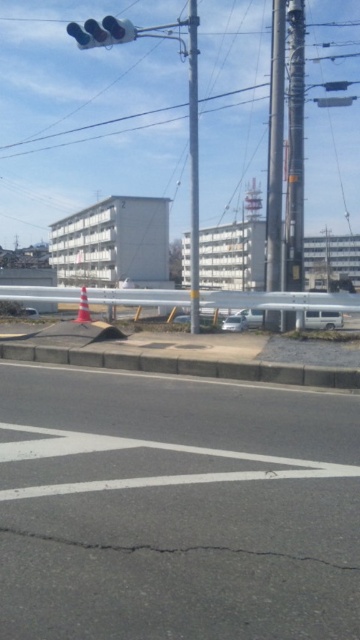
Is metallic traffic light at upper center to the left of orange reflective cone at center from the viewer's perspective?

Yes, metallic traffic light at upper center is to the left of orange reflective cone at center.

Is metallic traffic light at upper center further to camera compared to orange reflective cone at center?

Yes, metallic traffic light at upper center is behind orange reflective cone at center.

Between point (93, 32) and point (86, 314), which one is positioned behind?

The point (86, 314) is behind.

At what (x,y) coordinates should I click in order to perform the action: click on metallic traffic light at upper center. Please return your answer as a coordinate pair (x, y). Looking at the image, I should click on (101, 33).

Can you confirm if metallic gray pole at upper right is positioned below metallic pole at center?

Correct, metallic gray pole at upper right is located below metallic pole at center.

Is metallic gray pole at upper right bigger than metallic pole at center?

No, metallic gray pole at upper right is not bigger than metallic pole at center.

Which is in front, point (279, 179) or point (198, 248)?

Point (198, 248) is more forward.

You are a GUI agent. You are given a task and a screenshot of the screen. Output one action in this format:
    pyautogui.click(x=<x>, y=<y>)
    Task: Click on the metallic gray pole at upper right
    The image size is (360, 640).
    Given the screenshot: What is the action you would take?
    pyautogui.click(x=275, y=148)

Is point (204, 484) behind point (288, 80)?

No, (204, 484) is closer to viewer.

Can you confirm if black asphalt at center is positioned to the left of smooth metallic pole at center?

Indeed, black asphalt at center is positioned on the left side of smooth metallic pole at center.

Locate an element on the screen. black asphalt at center is located at coordinates (176, 508).